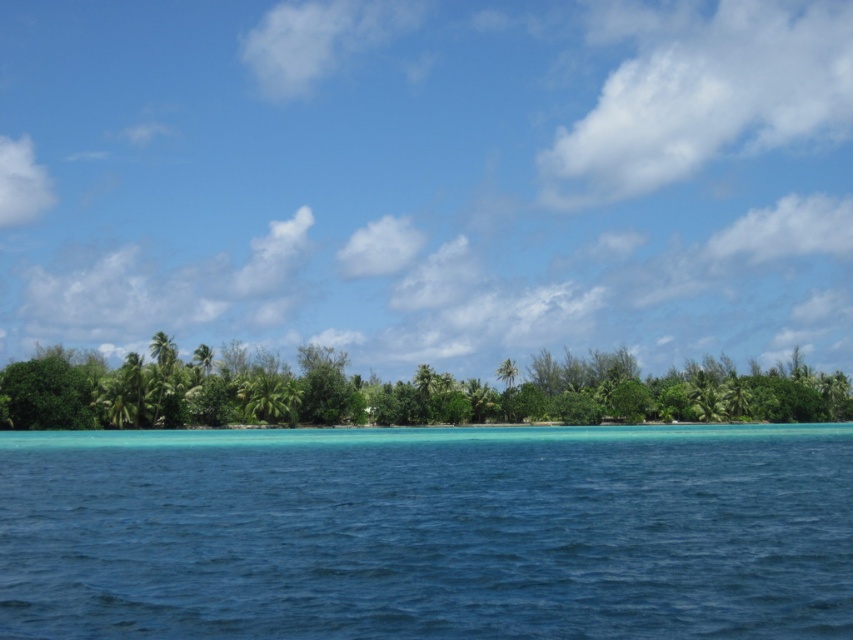
You are an environmental scientist assessing the biodiversity of this tropical area. You observe the green leafy trees at center and the green leafy palm tree at center. Which of these two has a larger canopy size?

The green leafy trees at center has a larger canopy size than the green leafy palm tree at center according to the description provided.

You are a photographer planning to capture the clear blue water at center in the image. Based on the scene description, where should you position your camera to ensure the water is centered in the frame?

The clear blue water at center is located at point (428, 532), so positioning the camera at those coordinates will ensure the water is centered in the frame.

You are standing at the edge of the tropical landscape facing the calm blue water. There are two points marked in the scene. Which point, point (120, 536) or point (254, 371), is closer to you?

Point (120, 536) is closer to the viewer than point (254, 371).